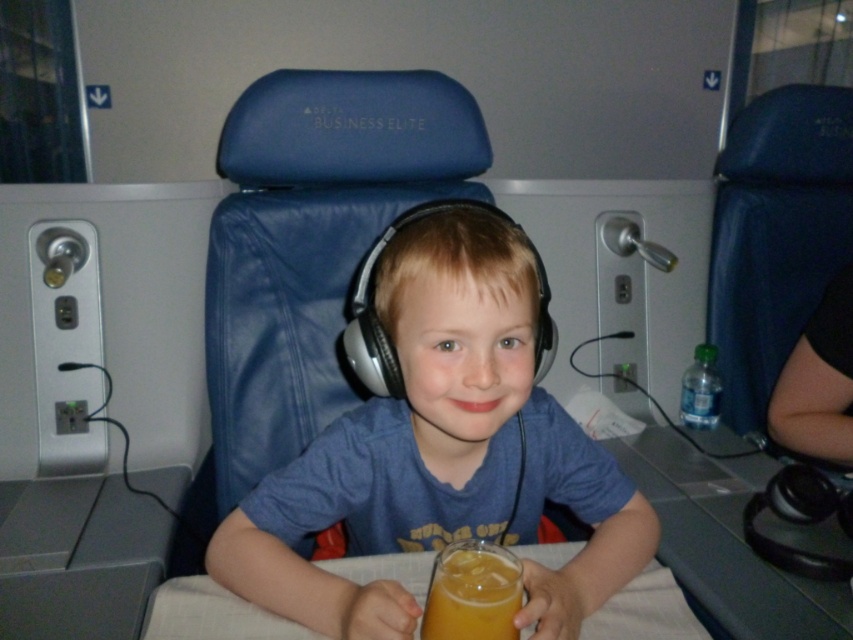
Can you confirm if white fabric table at center is smaller than clear plastic bottle at lower right?

No.

Which is below, white fabric table at center or clear plastic bottle at lower right?

white fabric table at center

Image resolution: width=853 pixels, height=640 pixels. In order to click on white fabric table at center in this screenshot , I will do `click(212, 614)`.

Locate an element on the screen. Image resolution: width=853 pixels, height=640 pixels. white fabric table at center is located at coordinates (212, 614).

Can you confirm if matte blue headphones at center is positioned to the left of translucent glass at center?

Correct, you'll find matte blue headphones at center to the left of translucent glass at center.

Is matte blue headphones at center in front of translucent glass at center?

No, matte blue headphones at center is behind translucent glass at center.

The width and height of the screenshot is (853, 640). I want to click on matte blue headphones at center, so click(x=440, y=452).

Identify the location of matte blue headphones at center. Image resolution: width=853 pixels, height=640 pixels. (440, 452).

Is translucent glass at center in front of clear plastic bottle at lower right?

Yes, translucent glass at center is in front of clear plastic bottle at lower right.

Is translucent glass at center further to camera compared to clear plastic bottle at lower right?

No, it is not.

Who is more distant from viewer, (436, 563) or (694, 348)?

The point (694, 348) is behind.

Locate an element on the screen. This screenshot has width=853, height=640. translucent glass at center is located at coordinates (473, 593).